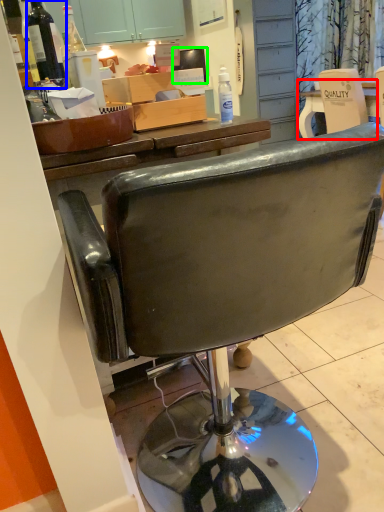
Question: Which object is the farthest from desk (highlighted by a red box)? Choose among these: bottle (highlighted by a blue box) or television (highlighted by a green box).

Choices:
 (A) bottle
 (B) television

Answer: (A)